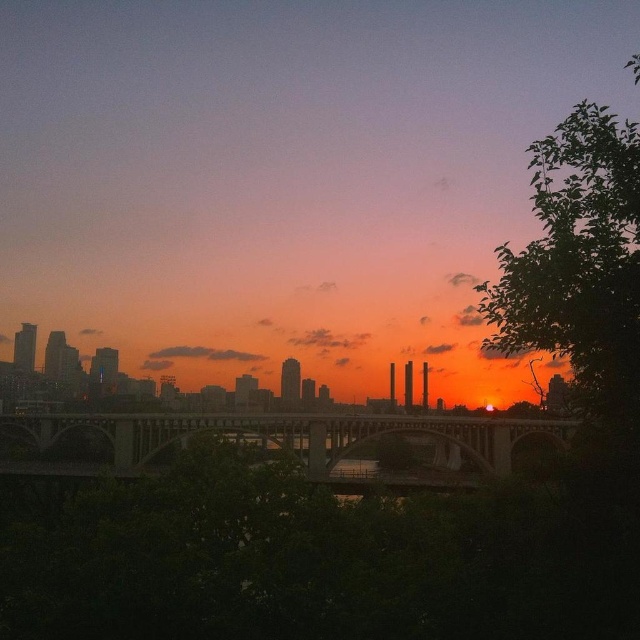
The width and height of the screenshot is (640, 640). What are the coordinates of `green leafy tree at right` in the screenshot? It's located at (579, 262).

Find the location of a particular element. The height and width of the screenshot is (640, 640). green leafy tree at right is located at coordinates (579, 262).

This screenshot has width=640, height=640. What are the coordinates of `green leafy tree at right` in the screenshot? It's located at (579, 262).